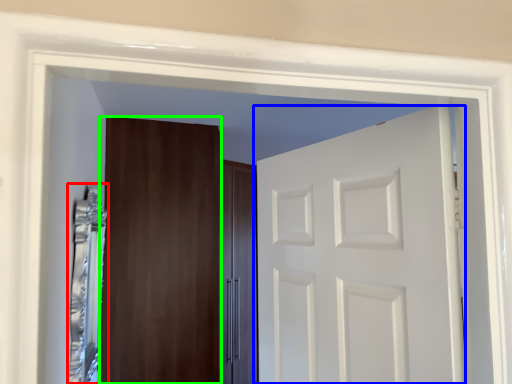
Question: Based on their relative distances, which object is farther from mirror (highlighted by a red box)? Choose from door (highlighted by a blue box) and door (highlighted by a green box).

Choices:
 (A) door
 (B) door

Answer: (A)